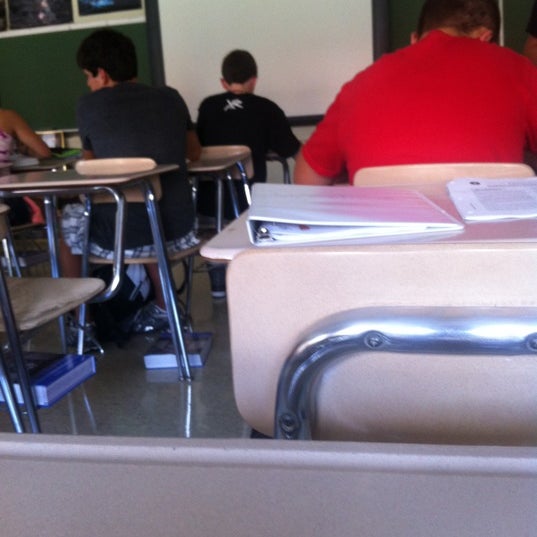
Image resolution: width=537 pixels, height=537 pixels. Find the location of `binder`. binder is located at coordinates (315, 208).